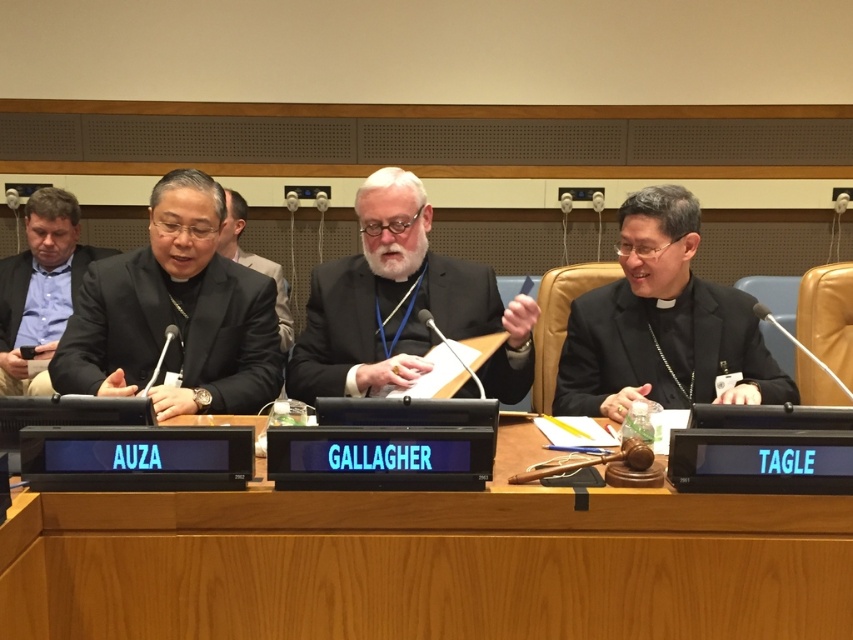
You are sitting at the long wooden table in the conference. You notice two points marked on the table. The first point is at coordinates point (x=761, y=532) and the second point is at coordinates point (x=381, y=355). Which point is closer to you?

Point (x=761, y=532) is in front of point (x=381, y=355), so the first point is closer to you.

You are an assistant in a courtroom. You need to place a new nameplate for the judge between the black satin robe at left and the black woolen robe at center. Which robe should the nameplate be placed closer to?

The black satin robe at left is positioned on the left side of the black woolen robe at center, so the nameplate should be placed closer to the black woolen robe at center since it is the center robe and likely belongs to the judge.

Looking at this image, you are an event organizer arranging seating for a formal conference. You need to place a podium between the black satin robe at left and the black matte robe at right. Based on their heights, which robe should be closer to the podium to ensure the speaker can be seen by the audience?

The black satin robe at left is much taller than the black matte robe at right, so placing the podium closer to the black satin robe at left would allow the speaker to be seen over the shorter robe.